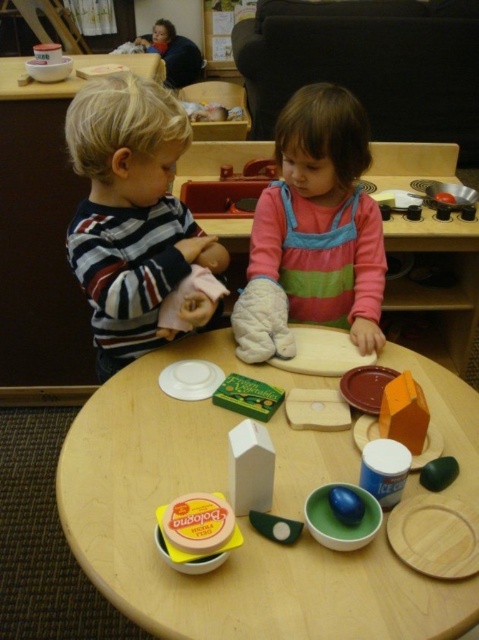
You are a teacher in the classroom and need to place a new toy on the table. The wooden toy at center and the striped cotton shirt at left are already there. Which object has a larger width?

The wooden toy at center has a larger width than the striped cotton shirt at left.

You are a teacher organizing a clothing donation drive. You need to decide which items are suitable for toddlers. Based on the scene, which clothing item is more likely to be appropriate for a toddler? Please choose between the striped cotton shirt at left and the pink striped dress at center.

The pink striped dress at center is more likely to be appropriate for a toddler since it is smaller than the striped cotton shirt at left, which may be better suited for an older child or adult.